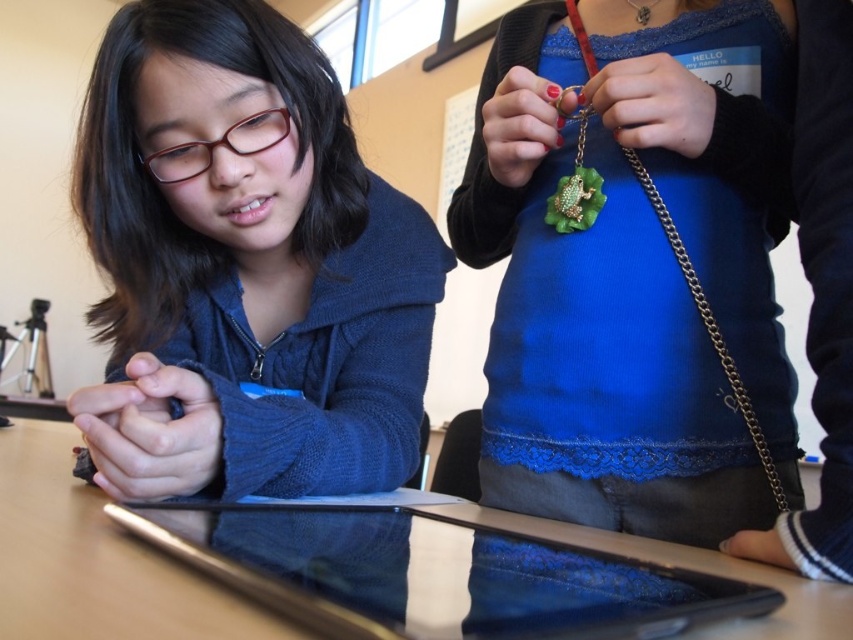
Question: Is green felt necklace at center in front of glossy wooden table at center?

Choices:
 (A) no
 (B) yes

Answer: (A)

Question: Based on their relative distances, which object is nearer to the glossy wooden table at center?

Choices:
 (A) silver metallic tablet at center
 (B) green felt necklace at center

Answer: (A)

Question: Which of these objects is positioned farthest from the glossy wooden table at center?

Choices:
 (A) matte blue sweater at center
 (B) silver metallic tablet at center
 (C) green felt necklace at center

Answer: (C)

Question: Is silver metallic tablet at center thinner than glossy wooden table at center?

Choices:
 (A) no
 (B) yes

Answer: (B)

Question: Is silver metallic tablet at center smaller than glossy wooden table at center?

Choices:
 (A) yes
 (B) no

Answer: (A)

Question: Which object is farther from the camera taking this photo?

Choices:
 (A) glossy wooden table at center
 (B) matte blue sweater at center

Answer: (B)